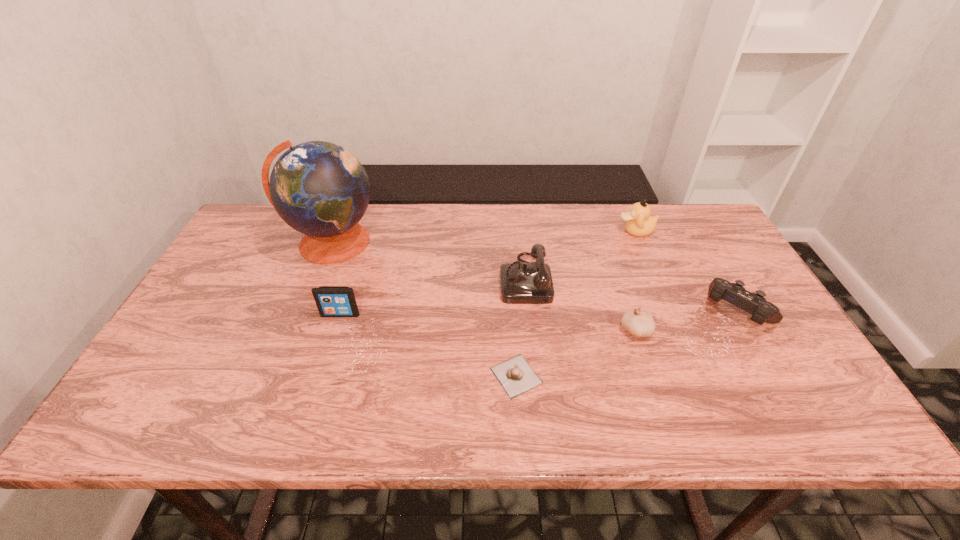
Identify the location of free space that is in between the nearer garlic and the iPod. (428, 345).

Where is `unoccupied position between the telephone and the iPod`? The image size is (960, 540). unoccupied position between the telephone and the iPod is located at coordinates (433, 296).

Point out which object is positioned as the second nearest to the right garlic. Please provide its 2D coordinates. Your answer should be formatted as a tuple, i.e. [(x, y)], where the tuple contains the x and y coordinates of a point satisfying the conditions above.

[(521, 283)]

I want to click on object identified as the fifth closest to the right garlic, so click(332, 301).

You are a GUI agent. You are given a task and a screenshot of the screen. Output one action in this format:
    pyautogui.click(x=<x>, y=<y>)
    Task: Click on the vacant area in the image that satisfies the following two spatial constraints: 1. on the back side of the control; 2. on the face of the second object from right to left
    The image size is (960, 540).
    Given the screenshot: What is the action you would take?
    pyautogui.click(x=691, y=231)

Where is `vacant space that satisfies the following two spatial constraints: 1. on the dial of the rightmost object; 2. on the left side of the telephone`? vacant space that satisfies the following two spatial constraints: 1. on the dial of the rightmost object; 2. on the left side of the telephone is located at coordinates (529, 311).

Find the location of `free space that satisfies the following two spatial constraints: 1. on the dial of the control; 2. on the right side of the telephone`. free space that satisfies the following two spatial constraints: 1. on the dial of the control; 2. on the right side of the telephone is located at coordinates (529, 311).

This screenshot has width=960, height=540. Find the location of `vacant area that satisfies the following two spatial constraints: 1. on the dial of the telephone; 2. on the back side of the rightmost object`. vacant area that satisfies the following two spatial constraints: 1. on the dial of the telephone; 2. on the back side of the rightmost object is located at coordinates (529, 311).

Locate an element on the screen. The width and height of the screenshot is (960, 540). free space that satisfies the following two spatial constraints: 1. on the dial of the telephone; 2. on the front screen of the iPod is located at coordinates (529, 314).

The width and height of the screenshot is (960, 540). I want to click on free space that satisfies the following two spatial constraints: 1. on the dial of the telephone; 2. on the front screen of the iPod, so click(x=529, y=314).